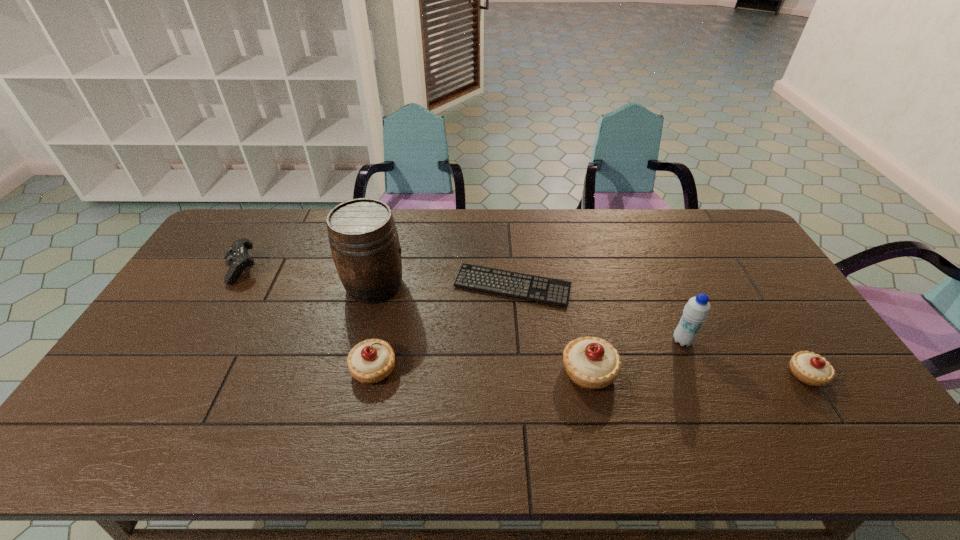
At what (x,y) coordinates should I click in order to perform the action: click on object that is at the near right corner. Please return your answer as a coordinate pair (x, y). Looking at the image, I should click on (810, 368).

This screenshot has height=540, width=960. In the image, there is a desktop. What are the coordinates of `vacant space at the far edge` in the screenshot? It's located at (302, 210).

Where is `free space at the near edge of the desktop`? free space at the near edge of the desktop is located at coordinates (449, 402).

In order to click on free region at the right edge of the desktop in this screenshot , I will do `click(796, 313)`.

Find the location of a particular element. The height and width of the screenshot is (540, 960). vacant area at the far left corner is located at coordinates (231, 240).

The image size is (960, 540). Find the location of `vacant region at the far right corner of the desktop`. vacant region at the far right corner of the desktop is located at coordinates (714, 211).

What are the coordinates of `free spot between the second tallest object and the shortest object` in the screenshot? It's located at click(597, 313).

Locate an element on the screen. blank region between the tallest object and the second tallest object is located at coordinates (529, 313).

Locate an element on the screen. This screenshot has height=540, width=960. empty space between the fourth tallest object and the shortest object is located at coordinates (444, 327).

In order to click on free space that is in between the cider and the computer keyboard in this screenshot , I will do `click(444, 286)`.